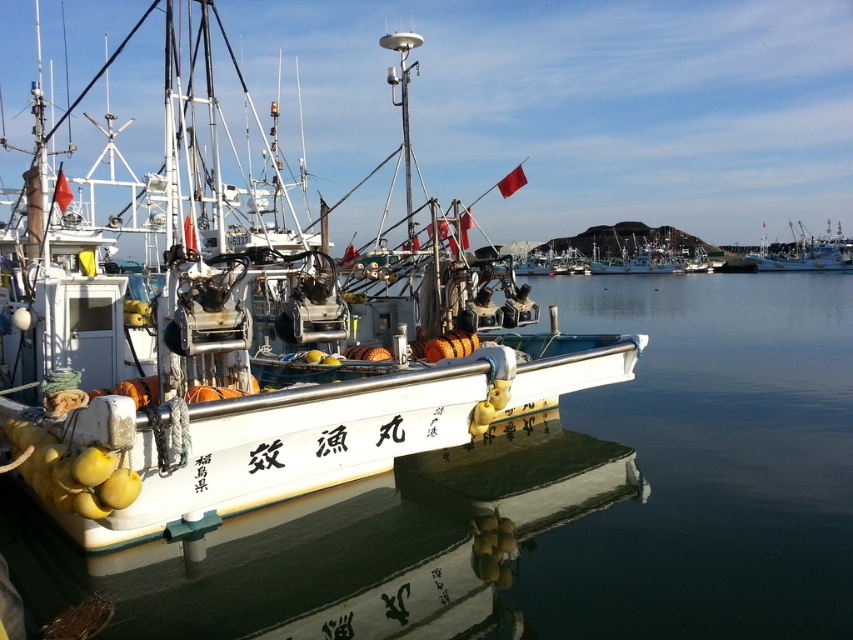
You are standing on the fishing boat and looking at the point marked at coordinates (x=549, y=500). Based on the scene description, where is this point located relative to the boat?

The point marked at coordinates (x=549, y=500) is on the white glossy water at center, which is likely the water surface in the middle of the harbor. Since the boat is in the foreground, the point is probably located in the water away from the boat.

You are a harbor inspector who needs to ensure safe navigation between the white matte boat at center and the white matte boat at right. The minimum safe distance required is 90 meters. Based on the scene, is the current distance sufficient?

The distance between the white matte boat at center and the white matte boat at right is 88.61 meters, which is less than the required 90 meters. Therefore, the current distance is insufficient for safe navigation.